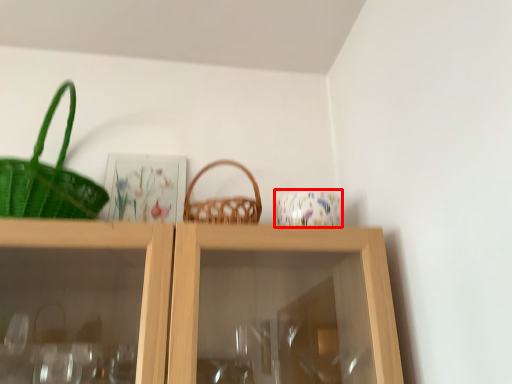
Question: In this image, where is tableware (annotated by the red box) located relative to picnic basket?

Choices:
 (A) left
 (B) right

Answer: (B)